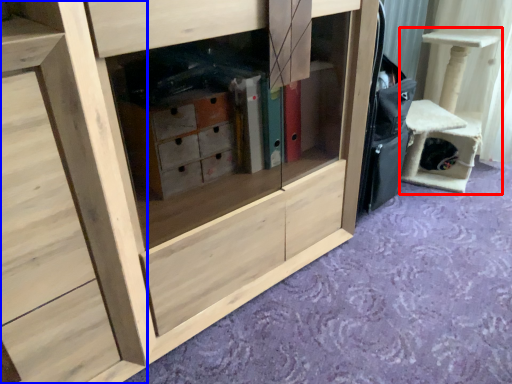
Question: Which of the following is the farthest to the observer, furniture (highlighted by a red box) or chest of drawers (highlighted by a blue box)?

Choices:
 (A) furniture
 (B) chest of drawers

Answer: (A)